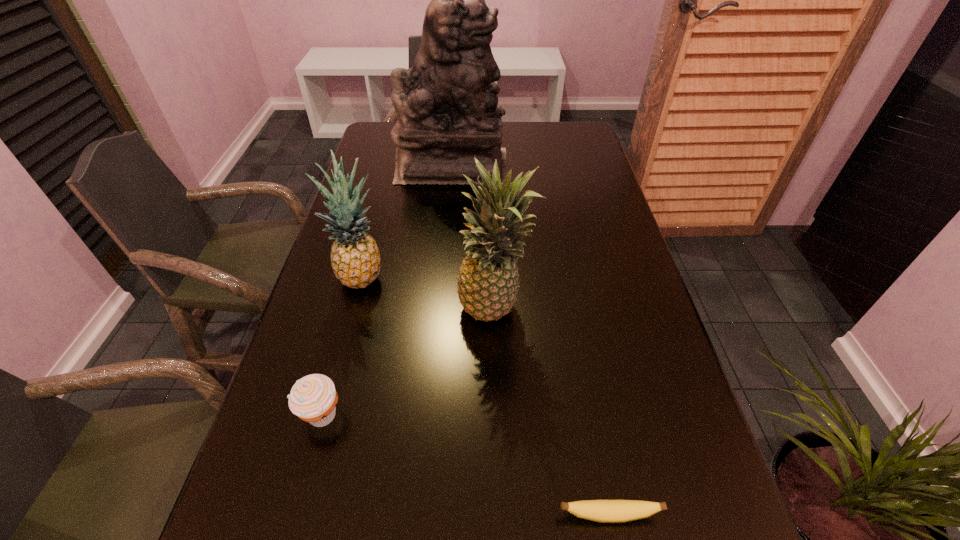
Locate an element on the screen. vacant space at the left edge of the desktop is located at coordinates (300, 353).

The height and width of the screenshot is (540, 960). In the image, there is a desktop. What are the coordinates of `vacant area at the right edge` in the screenshot? It's located at (588, 269).

The width and height of the screenshot is (960, 540). I want to click on free location at the far left corner of the desktop, so click(368, 145).

Locate an element on the screen. This screenshot has height=540, width=960. vacant space at the far right corner of the desktop is located at coordinates (550, 132).

This screenshot has height=540, width=960. Find the location of `vacant area that lies between the left pineapple and the shortest object`. vacant area that lies between the left pineapple and the shortest object is located at coordinates (486, 396).

The height and width of the screenshot is (540, 960). Identify the location of vacant point located between the fourth tallest object and the sculpture. pyautogui.click(x=387, y=291).

Identify the location of empty location between the second nearest object and the right pineapple. This screenshot has width=960, height=540. (408, 363).

This screenshot has width=960, height=540. I want to click on free space between the second shortest object and the right pineapple, so click(x=408, y=363).

I want to click on blank region between the shortest object and the right pineapple, so click(x=552, y=413).

Where is `free space between the left pineapple and the nearest object`? This screenshot has width=960, height=540. free space between the left pineapple and the nearest object is located at coordinates (486, 396).